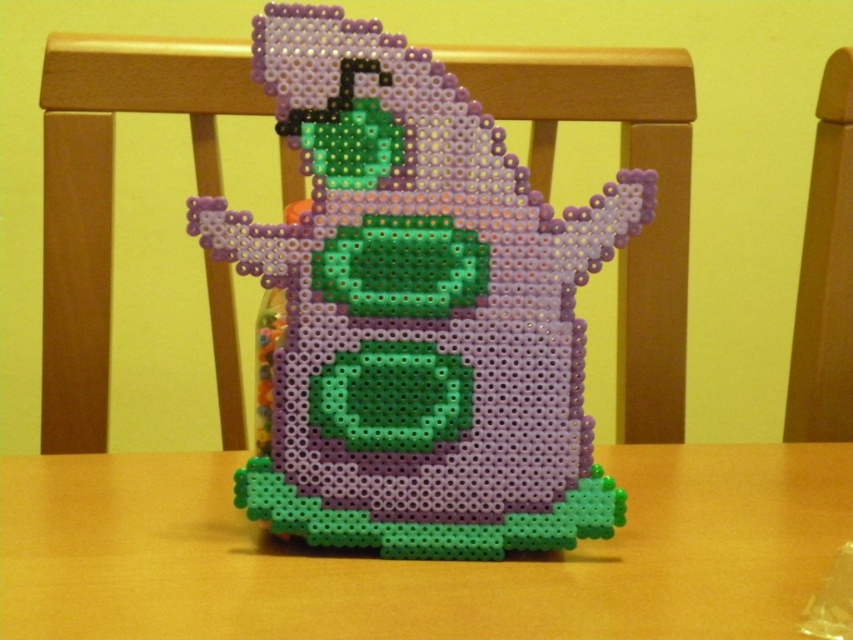
In the scene shown: Which is above, perler bead ghost at center or wooden table at center?

Positioned higher is perler bead ghost at center.

Which is behind, point (590, 454) or point (122, 584)?

The point (590, 454) is more distant.

Which is behind, point (384, 276) or point (0, 620)?

The point (384, 276) is more distant.

I want to click on perler bead ghost at center, so click(418, 310).

Which of these two, wooden table at center or wooden chair at right, stands taller?

With more height is wooden chair at right.

Between wooden table at center and wooden chair at right, which one appears on the right side from the viewer's perspective?

Positioned to the right is wooden chair at right.

The height and width of the screenshot is (640, 853). I want to click on wooden table at center, so click(x=418, y=561).

Between perler bead ghost at center and wooden chair at right, which one is positioned higher?

wooden chair at right is higher up.

Is point (541, 392) farther from camera compared to point (846, 358)?

No, it is not.

Between point (308, 72) and point (848, 308), which one is positioned in front?

Point (308, 72) is in front.

The width and height of the screenshot is (853, 640). In order to click on perler bead ghost at center in this screenshot , I will do `click(418, 310)`.